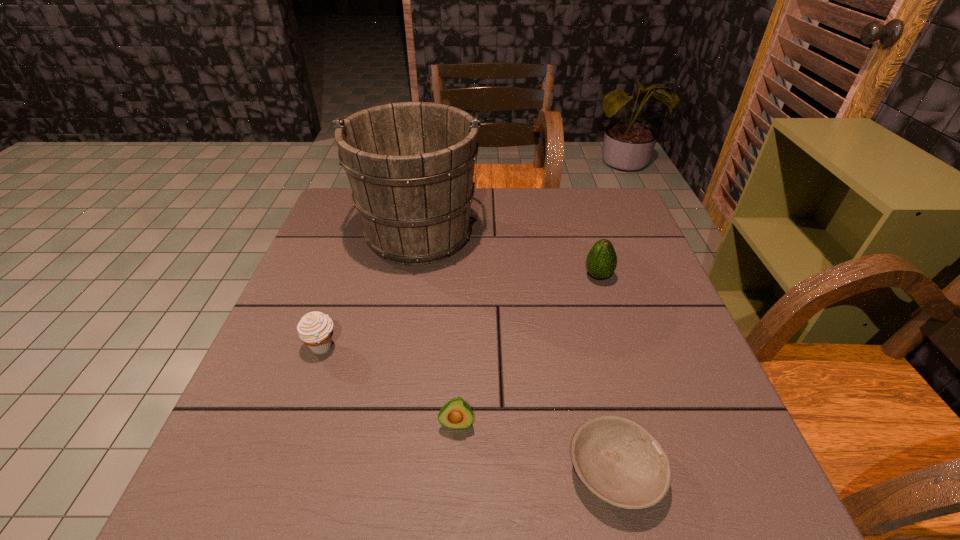
This screenshot has height=540, width=960. What are the coordinates of `the tallest object` in the screenshot? It's located at (410, 165).

Where is `the right avocado`? the right avocado is located at coordinates tap(601, 262).

I want to click on the farther avocado, so click(x=601, y=262).

The height and width of the screenshot is (540, 960). What are the coordinates of `muffin` in the screenshot? It's located at (315, 329).

This screenshot has height=540, width=960. Find the location of `the nearer avocado`. the nearer avocado is located at coordinates (456, 414).

This screenshot has height=540, width=960. In order to click on the left avocado in this screenshot , I will do `click(456, 414)`.

Where is `bowl`? bowl is located at coordinates (618, 460).

Locate an element on the screen. This screenshot has height=540, width=960. vacant space situated 0.310m on the left of the farther avocado is located at coordinates (459, 276).

This screenshot has height=540, width=960. Identify the location of free space located 0.060m on the left of the third farthest object. (277, 347).

Where is `vacant space located 0.120m on the cut side of the shorter avocado`? Image resolution: width=960 pixels, height=540 pixels. vacant space located 0.120m on the cut side of the shorter avocado is located at coordinates (453, 505).